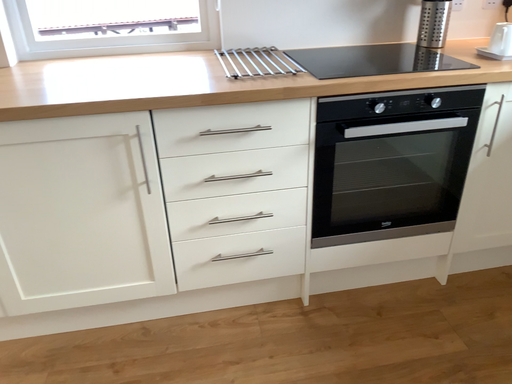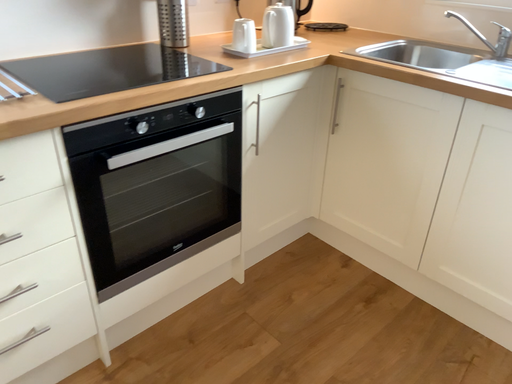
Question: Which way did the camera rotate in the video?

Choices:
 (A) rotated left
 (B) rotated right

Answer: (B)